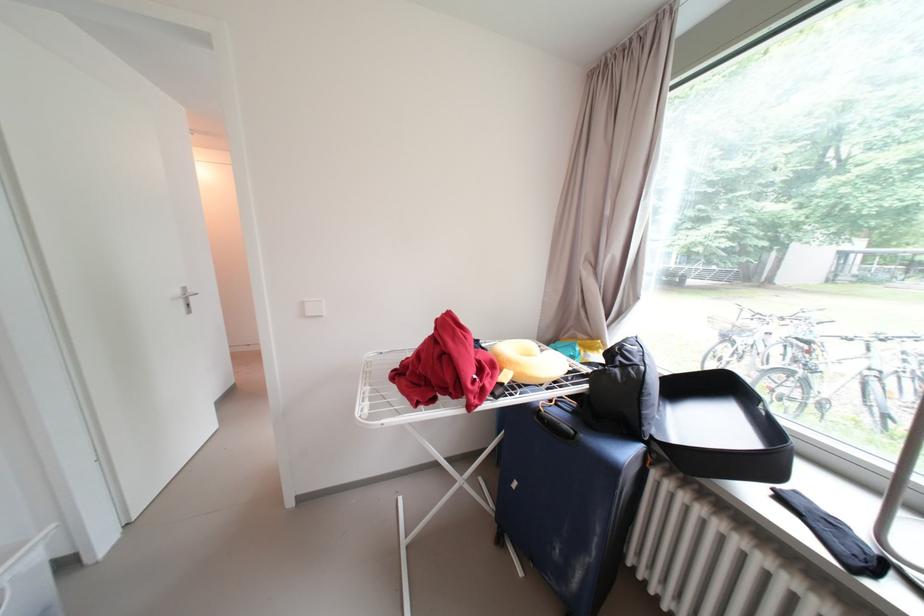
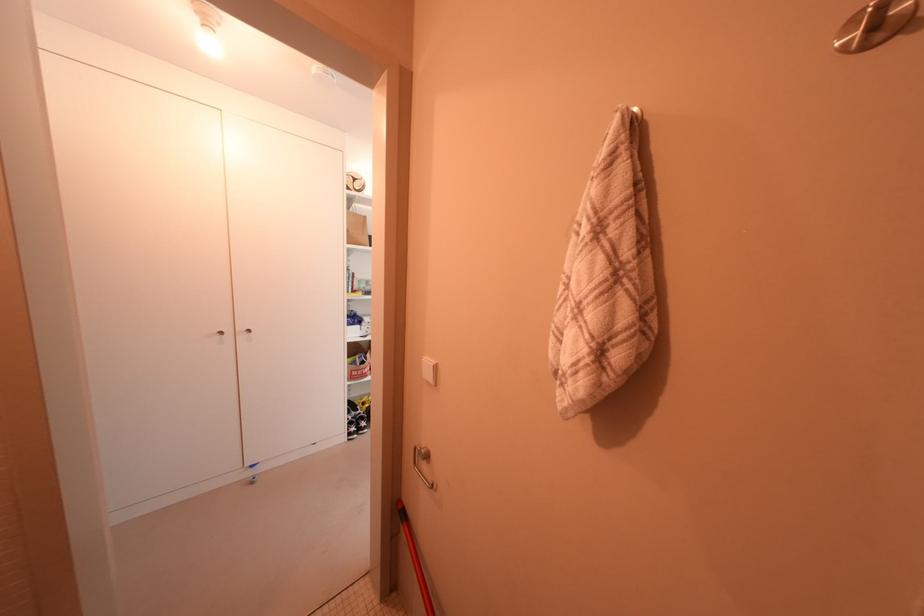
What movement of the cameraman would produce the second image?

The movement direction of the cameraman is left, forward.